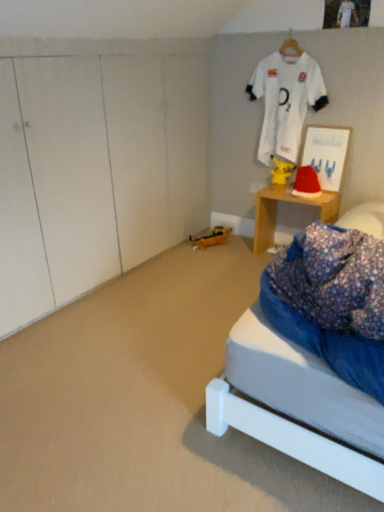
This screenshot has height=512, width=384. I want to click on vacant space situated above matte white picture frame at upper right (from a real-world perspective), so click(x=332, y=121).